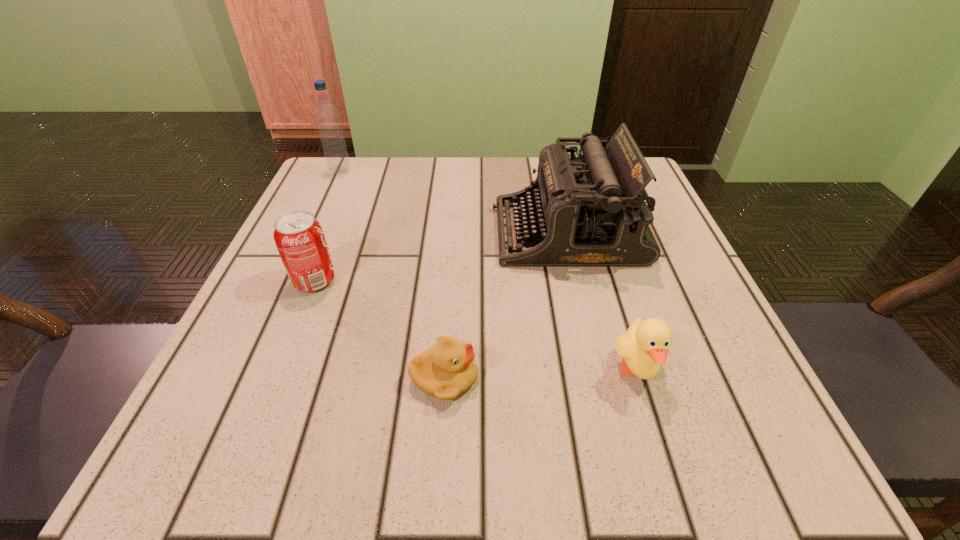
This screenshot has height=540, width=960. Find the location of `the farthest object`. the farthest object is located at coordinates (327, 116).

Find the location of a particular element. The image size is (960, 540). typewriter is located at coordinates tap(589, 211).

Where is `soda`? soda is located at coordinates (300, 240).

Find the location of `the right duckling`. the right duckling is located at coordinates (x=645, y=345).

Identify the location of the fourth tallest object. The height and width of the screenshot is (540, 960). (645, 345).

The width and height of the screenshot is (960, 540). What are the coordinates of `the shorter duckling` in the screenshot? It's located at (447, 369).

At what (x,y) coordinates should I click in order to perform the action: click on the shortest object. Please return your answer as a coordinate pair (x, y). This screenshot has height=540, width=960. Looking at the image, I should click on (447, 369).

The height and width of the screenshot is (540, 960). What are the coordinates of `vacant space positioned 0.380m on the right of the farthest object` in the screenshot? It's located at (512, 171).

At what (x,y) coordinates should I click in order to perform the action: click on blank area located on the keyboard of the typewriter. Please return your answer as a coordinate pair (x, y). This screenshot has width=960, height=540. Looking at the image, I should click on (372, 232).

Find the location of a particular element. The height and width of the screenshot is (540, 960). free point located 0.220m on the keyboard of the typewriter is located at coordinates (383, 232).